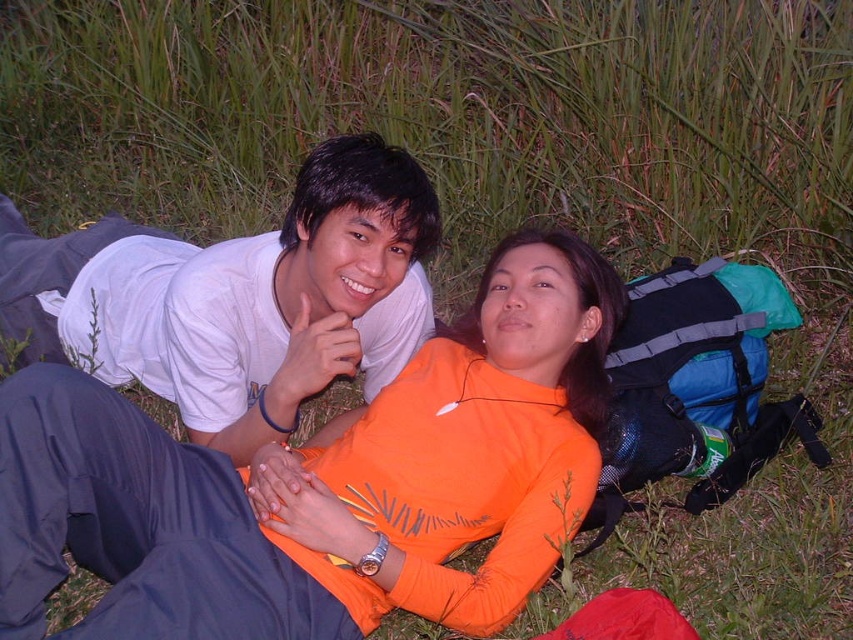
Question: Is orange fleece at center thinner than white matte t-shirt at upper left?

Choices:
 (A) yes
 (B) no

Answer: (A)

Question: Is orange fleece at center bigger than white matte t-shirt at upper left?

Choices:
 (A) no
 (B) yes

Answer: (A)

Question: Which point appears closest to the camera in this image?

Choices:
 (A) (74, 506)
 (B) (115, 308)

Answer: (A)

Question: Is orange fleece at center to the left of white matte t-shirt at upper left from the viewer's perspective?

Choices:
 (A) no
 (B) yes

Answer: (A)

Question: Which point appears closest to the camera in this image?

Choices:
 (A) (245, 337)
 (B) (393, 465)

Answer: (B)